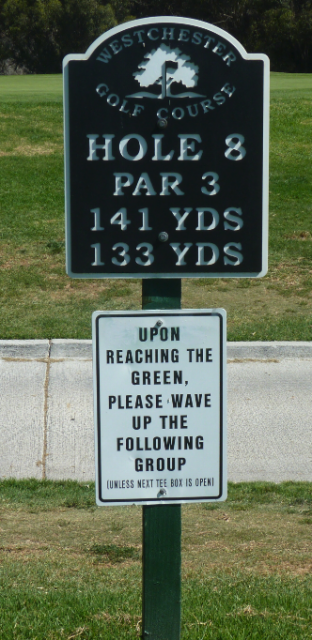
What are the coordinates of `wall` in the screenshot? It's located at click(4, 399).